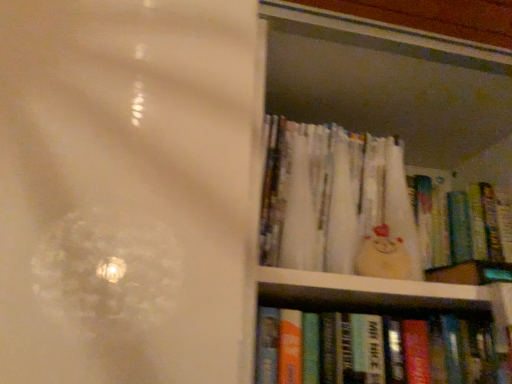
The image size is (512, 384). Find the location of `empty space that is ontop of hardcover book at lower right, the 3th book viewed from the top (from a real-world perspective)`. empty space that is ontop of hardcover book at lower right, the 3th book viewed from the top (from a real-world perspective) is located at coordinates (412, 318).